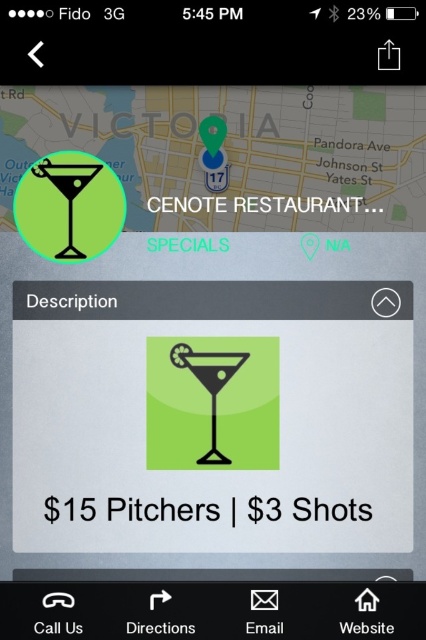
Question: Which object is farther from the camera taking this photo?

Choices:
 (A) matte glass at center
 (B) green matte martini glass at upper left

Answer: (B)

Question: Can you confirm if green matte martini glass at upper left is positioned to the right of matte glass at center?

Choices:
 (A) yes
 (B) no

Answer: (A)

Question: Does green matte martini glass at upper left appear over matte glass at center?

Choices:
 (A) yes
 (B) no

Answer: (A)

Question: Is green matte martini glass at upper left bigger than matte glass at center?

Choices:
 (A) no
 (B) yes

Answer: (A)

Question: Which object is closer to the camera taking this photo?

Choices:
 (A) matte glass at center
 (B) green matte martini glass at upper left

Answer: (A)